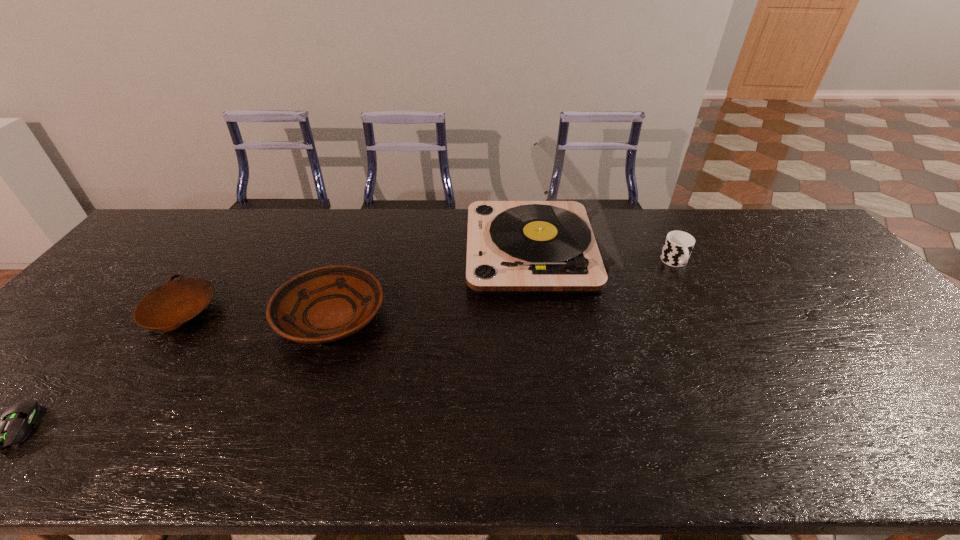
Where is `free space between the second object from right to left and the third object from left to right`? The height and width of the screenshot is (540, 960). free space between the second object from right to left and the third object from left to right is located at coordinates (434, 284).

Find the location of a particular element. blank region between the record player and the right plate is located at coordinates (434, 284).

Locate which object is the second closest to the nearest object. Please provide its 2D coordinates. Your answer should be formatted as a tuple, i.e. [(x, y)], where the tuple contains the x and y coordinates of a point satisfying the conditions above.

[(326, 304)]

Identify which object is the nearest to the second object from right to left. Please provide its 2D coordinates. Your answer should be formatted as a tuple, i.e. [(x, y)], where the tuple contains the x and y coordinates of a point satisfying the conditions above.

[(678, 245)]

The width and height of the screenshot is (960, 540). Identify the location of vacant point that satisfies the following two spatial constraints: 1. with the tonearm facing the front of the second object from right to left; 2. on the front side of the third tallest object. (546, 316).

You are a GUI agent. You are given a task and a screenshot of the screen. Output one action in this format:
    pyautogui.click(x=<x>, y=<y>)
    Task: Click on the free space that satisfies the following two spatial constraints: 1. with the tonearm facing the front of the second object from right to left; 2. on the front side of the shorter plate
    The height and width of the screenshot is (540, 960).
    Given the screenshot: What is the action you would take?
    pyautogui.click(x=545, y=312)

Identify the location of free space that satisfies the following two spatial constraints: 1. with the tonearm facing the front of the second object from right to left; 2. on the front side of the fourth object from right to left. (545, 312).

Locate an element on the screen. vacant point that satisfies the following two spatial constraints: 1. on the front side of the shorter plate; 2. on the right side of the third tallest object is located at coordinates (178, 316).